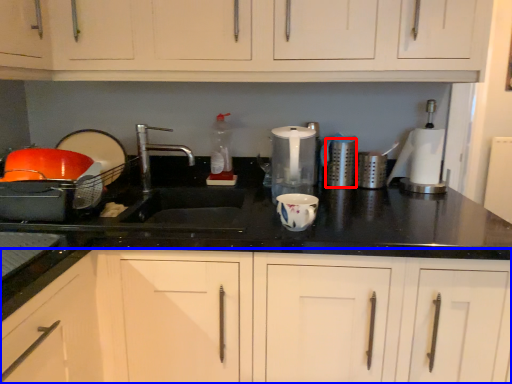
Question: Which of the following is the farthest to the observer, appliance (highlighted by a red box) or cabinetry (highlighted by a blue box)?

Choices:
 (A) appliance
 (B) cabinetry

Answer: (A)